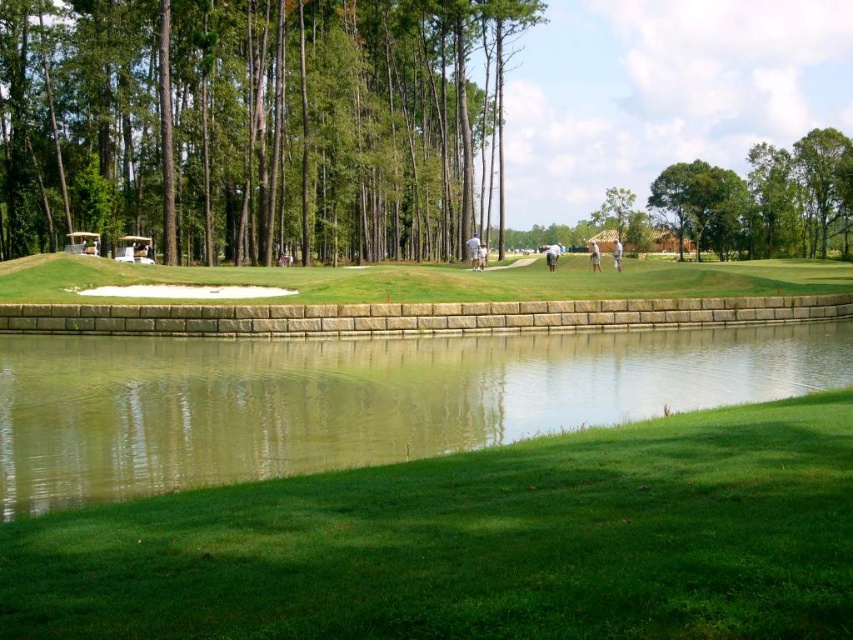
Looking at this image, you are standing at the origin point of the image. Which direction should you move to reach the green leafy tree at center?

The green leafy tree at center is located at point 0.334 on the x axis and 0.720 on the y axis. Since the origin is at the bottom left corner, you should move to the right and upwards to reach it.

You are a golfer standing at point (593, 240) and want to hit the ball to point (521, 339). Considering the slope of the terrain, which direction should you aim to reach the target?

Point (521, 339) is in front of point (593, 240), so you should aim towards the direction where the slope gently slopes towards the water to reach the target.

You are a golfer standing on the golf course and see the green leafy tree at center and the light brown wood golf club at center. Which object is closer to you?

The green leafy tree at center is closer to you because it is further to the viewer than the light brown wood golf club at center.